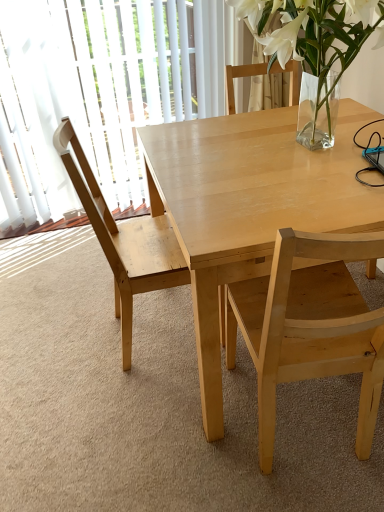
Question: Is transparent glass door at left completely or partially outside of light wood chair at center, placed as the first chair when sorted from right to left?

Choices:
 (A) yes
 (B) no

Answer: (A)

Question: Can you confirm if transparent glass door at left is wider than light wood chair at center, placed as the first chair when sorted from right to left?

Choices:
 (A) no
 (B) yes

Answer: (A)

Question: Is transparent glass door at left oriented away from light wood chair at center, placed as the first chair when sorted from right to left?

Choices:
 (A) yes
 (B) no

Answer: (B)

Question: From the image's perspective, is transparent glass door at left on top of light wood chair at center, which ranks as the 2th chair in left-to-right order?

Choices:
 (A) no
 (B) yes

Answer: (B)

Question: Could you tell me if transparent glass door at left is facing light wood chair at center, placed as the first chair when sorted from right to left?

Choices:
 (A) yes
 (B) no

Answer: (A)

Question: Is transparent glass door at left shorter than light wood chair at center, placed as the first chair when sorted from right to left?

Choices:
 (A) yes
 (B) no

Answer: (B)

Question: Is clear glass vase at upper right looking in the opposite direction of light wood table at center?

Choices:
 (A) yes
 (B) no

Answer: (B)

Question: From a real-world perspective, is clear glass vase at upper right positioned under light wood table at center based on gravity?

Choices:
 (A) yes
 (B) no

Answer: (B)

Question: Is clear glass vase at upper right closer to the viewer compared to light wood table at center?

Choices:
 (A) no
 (B) yes

Answer: (B)

Question: Considering the relative sizes of clear glass vase at upper right and light wood table at center in the image provided, is clear glass vase at upper right smaller than light wood table at center?

Choices:
 (A) yes
 (B) no

Answer: (A)

Question: Can you confirm if clear glass vase at upper right is wider than light wood table at center?

Choices:
 (A) no
 (B) yes

Answer: (A)

Question: Could you tell me if clear glass vase at upper right is turned towards light wood table at center?

Choices:
 (A) no
 (B) yes

Answer: (A)

Question: Is light wood chair at left, which is counted as the 2th chair, starting from the right, a part of light wood table at center?

Choices:
 (A) no
 (B) yes

Answer: (B)